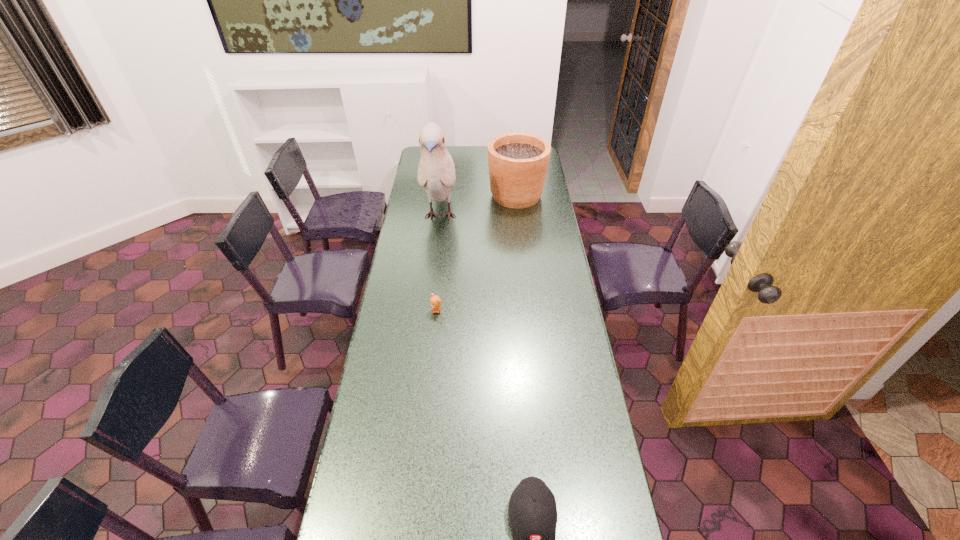
Where is `parakeet`? This screenshot has width=960, height=540. parakeet is located at coordinates (436, 172).

Locate an element on the screen. This screenshot has height=540, width=960. flowerpot is located at coordinates (518, 162).

The height and width of the screenshot is (540, 960). Identify the location of teddy bear. (435, 301).

Identify the location of the shortest object. This screenshot has width=960, height=540. coord(435,301).

Where is `vacant point located on the face of the parakeet`? This screenshot has width=960, height=540. vacant point located on the face of the parakeet is located at coordinates (435, 264).

Where is `vacant space located 0.390m on the front of the flowerpot`? vacant space located 0.390m on the front of the flowerpot is located at coordinates (523, 262).

The height and width of the screenshot is (540, 960). I want to click on vacant space located on the face of the shortest object, so click(x=433, y=340).

Locate an element on the screen. This screenshot has height=540, width=960. object that is at the left edge is located at coordinates (436, 172).

Locate an element on the screen. This screenshot has height=540, width=960. object present at the right edge is located at coordinates (518, 162).

At what (x,y) coordinates should I click in order to perform the action: click on vacant space at the far edge of the desktop. Please return your answer as a coordinate pair (x, y). Looking at the image, I should click on (469, 149).